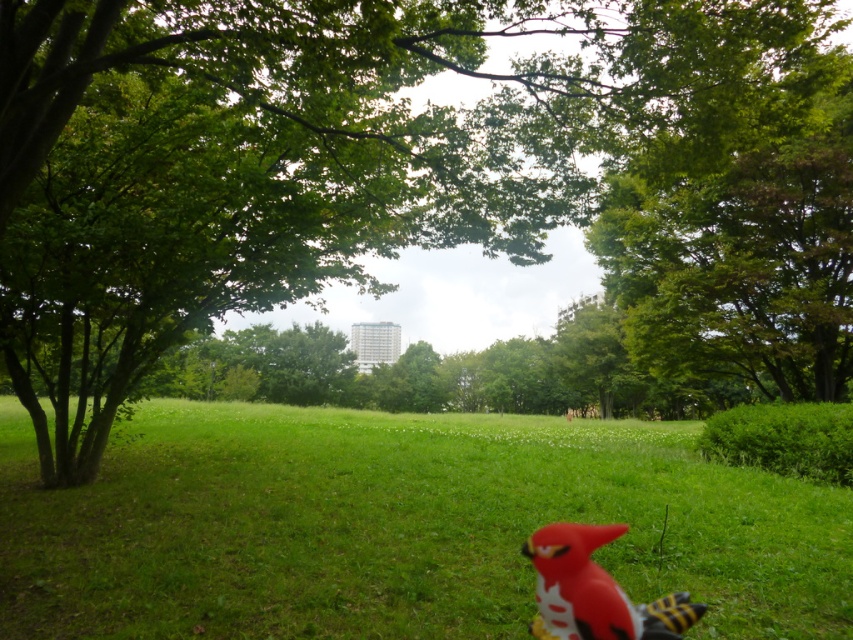
You are standing in the park and want to take a closer look at the green leafy tree at upper right. Given that you can walk at a speed of 3 feet per second, how many seconds will it take you to reach the tree?

The green leafy tree at upper right is 19.85 feet away from viewer. At a walking speed of 3 feet per second, it will take approximately 6.6 seconds to reach the tree.

You are standing in the park and want to take a photo of the green leafy tree at upper right. Where exactly should you point your camera?

You should point your camera to the coordinates point at upper right at point (741, 237) to capture the green leafy tree at upper right.